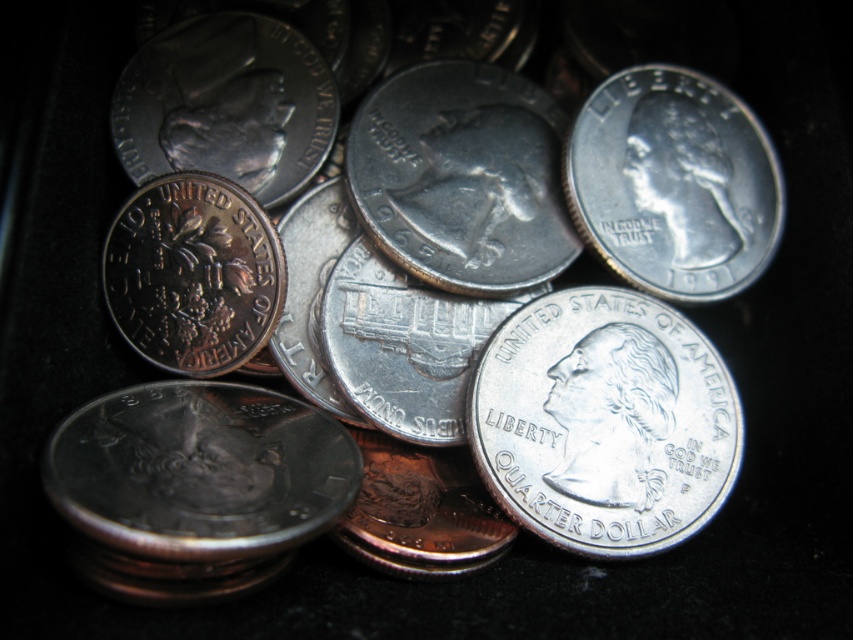
Which of these two, silver/reflective quarter dollar at center or silver/reflective quarter dollar at upper right, stands shorter?

silver/reflective quarter dollar at upper right

Based on the photo, between silver/reflective quarter dollar at center and silver/reflective quarter dollar at upper right, which one appears on the left side from the viewer's perspective?

silver/reflective quarter dollar at center

This screenshot has width=853, height=640. I want to click on silver/reflective quarter dollar at center, so click(604, 422).